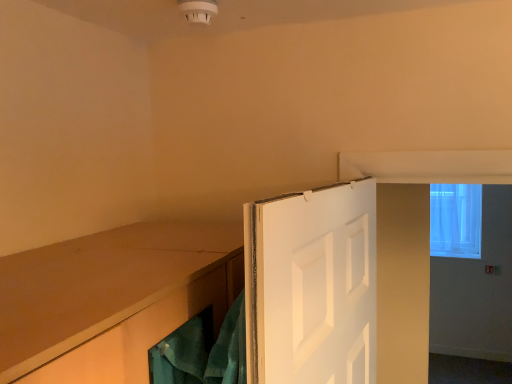
At what (x,y) coordinates should I click in order to perform the action: click on transparent fabric window at upper right. Please return your answer as a coordinate pair (x, y). Looking at the image, I should click on (x=455, y=220).

This screenshot has height=384, width=512. What do you see at coordinates (455, 220) in the screenshot?
I see `transparent fabric window at upper right` at bounding box center [455, 220].

What do you see at coordinates (312, 285) in the screenshot? The image size is (512, 384). I see `white painted wood door at center` at bounding box center [312, 285].

Where is `white painted wood door at center`? The image size is (512, 384). white painted wood door at center is located at coordinates (312, 285).

Where is `transparent fabric window at upper right`? The width and height of the screenshot is (512, 384). transparent fabric window at upper right is located at coordinates (455, 220).

Would you say transparent fabric window at upper right is to the left or to the right of white painted wood door at center in the picture?

From the image, it's evident that transparent fabric window at upper right is to the right of white painted wood door at center.

Which object is more forward, transparent fabric window at upper right or white painted wood door at center?

white painted wood door at center is more forward.

Considering the positions of point (480, 249) and point (339, 216), is point (480, 249) closer or farther from the camera than point (339, 216)?

Point (480, 249) is farther from the camera than point (339, 216).

From the image's perspective, which is below, transparent fabric window at upper right or white painted wood door at center?

white painted wood door at center appears lower in the image.

From a real-world perspective, is transparent fabric window at upper right located higher than white painted wood door at center?

No, from a real-world perspective, transparent fabric window at upper right is not over white painted wood door at center

In terms of width, does transparent fabric window at upper right look wider or thinner when compared to white painted wood door at center?

Clearly, transparent fabric window at upper right has more width compared to white painted wood door at center.

Considering the sizes of objects transparent fabric window at upper right and white painted wood door at center in the image provided, who is shorter, transparent fabric window at upper right or white painted wood door at center?

Standing shorter between the two is white painted wood door at center.

Is transparent fabric window at upper right bigger than white painted wood door at center?

Actually, transparent fabric window at upper right might be smaller than white painted wood door at center.

Is transparent fabric window at upper right not within white painted wood door at center?

That's correct, transparent fabric window at upper right is outside of white painted wood door at center.

Is transparent fabric window at upper right not close to white painted wood door at center?

Yes.

Is transparent fabric window at upper right facing away from white painted wood door at center?

No.

Measure the distance between transparent fabric window at upper right and white painted wood door at center.

3.59 meters.

Identify the location of door in front of the transparent fabric window at upper right. The height and width of the screenshot is (384, 512). 312,285.

Considering the relative positions of white painted wood door at center and transparent fabric window at upper right in the image provided, is white painted wood door at center to the left or to the right of transparent fabric window at upper right?

white painted wood door at center is positioned on transparent fabric window at upper right's left side.

Between white painted wood door at center and transparent fabric window at upper right, which one is positioned behind?

Positioned behind is transparent fabric window at upper right.

Is point (358, 201) positioned in front of point (432, 241)?

Yes, it is.

From the image's perspective, would you say white painted wood door at center is shown under transparent fabric window at upper right?

Yes.

From a real-world perspective, which is physically above, white painted wood door at center or transparent fabric window at upper right?

white painted wood door at center is physically above.

Is white painted wood door at center wider or thinner than transparent fabric window at upper right?

In the image, white painted wood door at center appears to be more narrow than transparent fabric window at upper right.

Considering the sizes of objects white painted wood door at center and transparent fabric window at upper right in the image provided, who is shorter, white painted wood door at center or transparent fabric window at upper right?

white painted wood door at center is shorter.

Considering the sizes of objects white painted wood door at center and transparent fabric window at upper right in the image provided, who is bigger, white painted wood door at center or transparent fabric window at upper right?

white painted wood door at center.

Is white painted wood door at center inside or outside of transparent fabric window at upper right?

white painted wood door at center is located beyond the bounds of transparent fabric window at upper right.

Is white painted wood door at center not close to transparent fabric window at upper right?

Yes.

Is white painted wood door at center facing away from transparent fabric window at upper right?

No, white painted wood door at center's orientation is not away from transparent fabric window at upper right.

What's the angular difference between white painted wood door at center and transparent fabric window at upper right's facing directions?

There is a 82.6-degree angle between the facing directions of white painted wood door at center and transparent fabric window at upper right.

How distant is white painted wood door at center from transparent fabric window at upper right?

white painted wood door at center and transparent fabric window at upper right are 3.59 meters apart from each other.

At what (x,y) coordinates should I click in order to perform the action: click on door on the left of transparent fabric window at upper right. Please return your answer as a coordinate pair (x, y). The width and height of the screenshot is (512, 384). Looking at the image, I should click on (312, 285).

At what (x,y) coordinates should I click in order to perform the action: click on window above the white painted wood door at center (from the image's perspective). Please return your answer as a coordinate pair (x, y). The image size is (512, 384). Looking at the image, I should click on (455, 220).

Find the location of `door in front of the transparent fabric window at upper right`. door in front of the transparent fabric window at upper right is located at coordinates (312, 285).